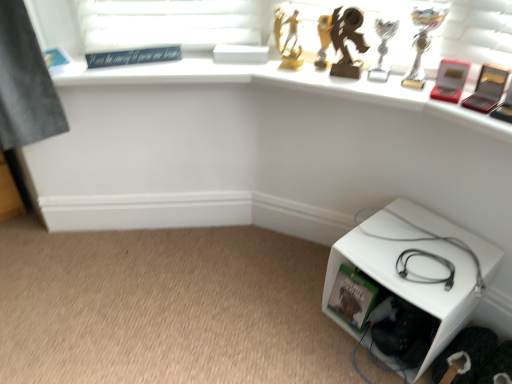
Question: Is white plastic cube at lower right facing away from gray matte cable at lower right?

Choices:
 (A) no
 (B) yes

Answer: (A)

Question: Does white plastic cube at lower right contain gray matte cable at lower right?

Choices:
 (A) no
 (B) yes

Answer: (A)

Question: Are white plastic cube at lower right and gray matte cable at lower right far apart?

Choices:
 (A) yes
 (B) no

Answer: (B)

Question: From a real-world perspective, is white plastic cube at lower right located higher than gray matte cable at lower right?

Choices:
 (A) yes
 (B) no

Answer: (B)

Question: Is white plastic cube at lower right positioned behind gray matte cable at lower right?

Choices:
 (A) no
 (B) yes

Answer: (A)

Question: Can you confirm if white plastic cube at lower right is taller than gray matte cable at lower right?

Choices:
 (A) yes
 (B) no

Answer: (A)

Question: Does gray matte cable at lower right appear on the right side of white plastic cube at lower right?

Choices:
 (A) yes
 (B) no

Answer: (B)

Question: Can we say gray matte cable at lower right lies outside white plastic cube at lower right?

Choices:
 (A) no
 (B) yes

Answer: (B)

Question: Is gray matte cable at lower right facing away from white plastic cube at lower right?

Choices:
 (A) yes
 (B) no

Answer: (B)

Question: Does gray matte cable at lower right lie in front of white plastic cube at lower right?

Choices:
 (A) no
 (B) yes

Answer: (A)

Question: Can you confirm if gray matte cable at lower right is shorter than white plastic cube at lower right?

Choices:
 (A) no
 (B) yes

Answer: (B)

Question: Is the position of gray matte cable at lower right more distant than that of white plastic cube at lower right?

Choices:
 (A) no
 (B) yes

Answer: (B)

Question: From a real-world perspective, is white plastic cube at lower right above or below gray matte cable at lower right?

Choices:
 (A) above
 (B) below

Answer: (B)